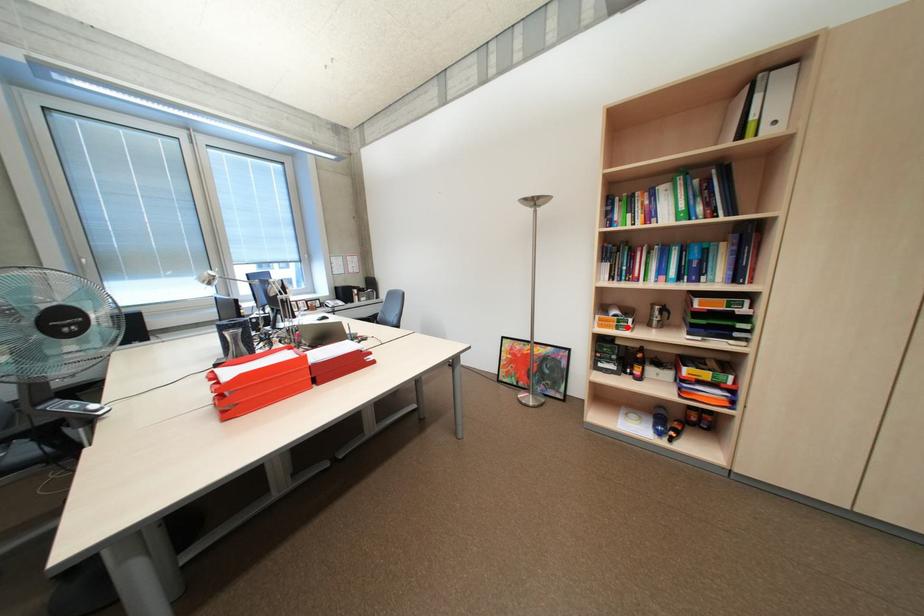
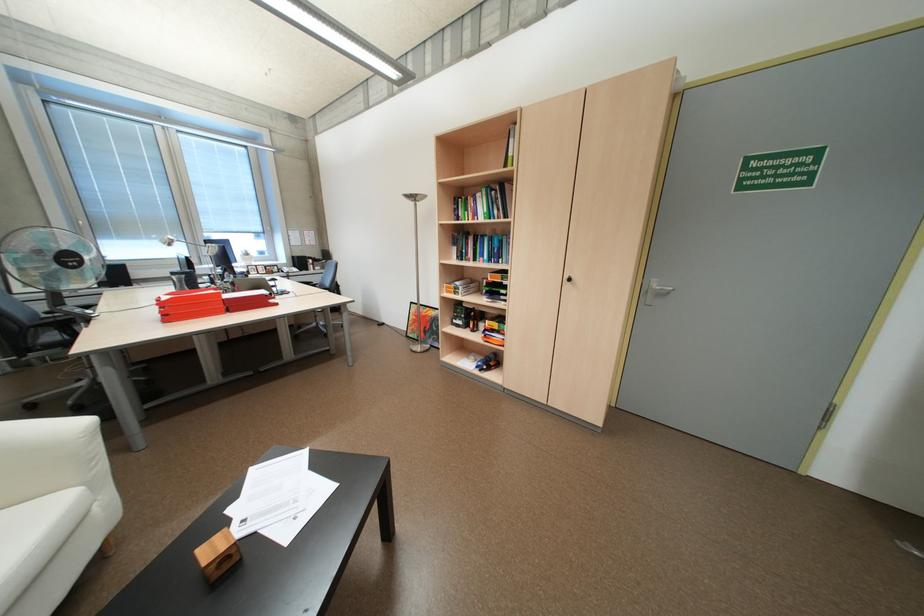
Find the pixel in the second image that matches the highlighted location in the first image.

(465, 293)